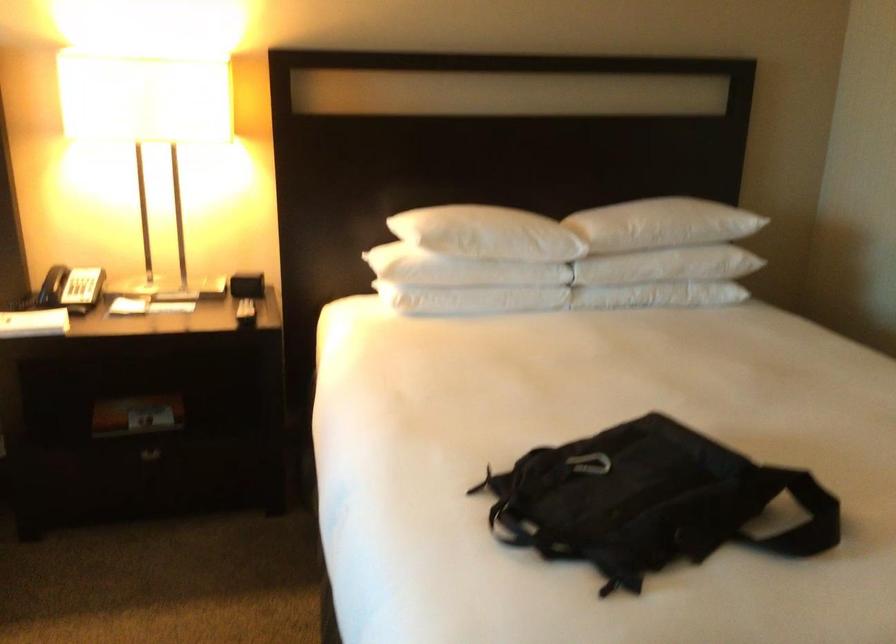
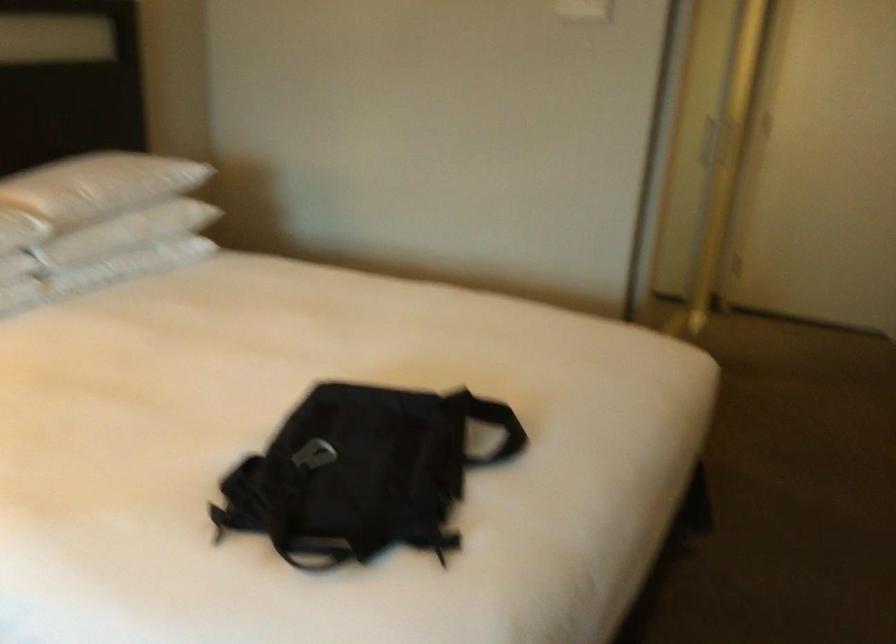
Question: The camera is either moving clockwise (left) or counter-clockwise (right) around the object. The first image is from the beginning of the video and the second image is from the end. Is the camera moving left or right when shooting the video?

Choices:
 (A) Left
 (B) Right

Answer: (A)